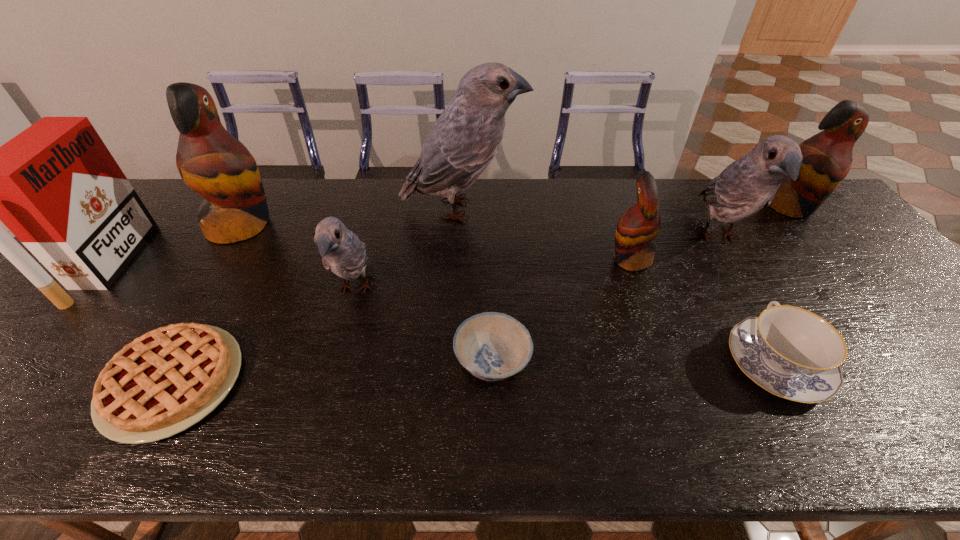
Locate an element on the screen. the fourth object from right to left is located at coordinates (638, 226).

This screenshot has height=540, width=960. I want to click on the smallest red parrot, so click(638, 226).

The image size is (960, 540). In order to click on the seventh object from right to left in this screenshot , I will do `click(342, 252)`.

What are the coordinates of `the leftmost gray parrot` in the screenshot? It's located at (342, 252).

Image resolution: width=960 pixels, height=540 pixels. What are the coordinates of `blue chinaware` in the screenshot? It's located at (791, 352).

You are a GUI agent. You are given a task and a screenshot of the screen. Output one action in this format:
    pyautogui.click(x=<x>, y=<y>)
    Task: Click on the eighth tallest object
    This screenshot has width=960, height=540.
    Given the screenshot: What is the action you would take?
    pyautogui.click(x=791, y=352)

You are a GUI agent. You are given a task and a screenshot of the screen. Output one action in this format:
    pyautogui.click(x=<x>, y=<y>)
    Task: Click on the second shortest object
    The width and height of the screenshot is (960, 540).
    Given the screenshot: What is the action you would take?
    pyautogui.click(x=492, y=346)

The image size is (960, 540). Identify the location of blue bowl. (492, 346).

You are a GUI agent. You are given a task and a screenshot of the screen. Output one action in this format:
    pyautogui.click(x=<x>, y=<y>)
    Task: Click on the shortest object
    
    Given the screenshot: What is the action you would take?
    point(165,381)

Identify the location of tan pie. The image size is (960, 540). (165, 381).